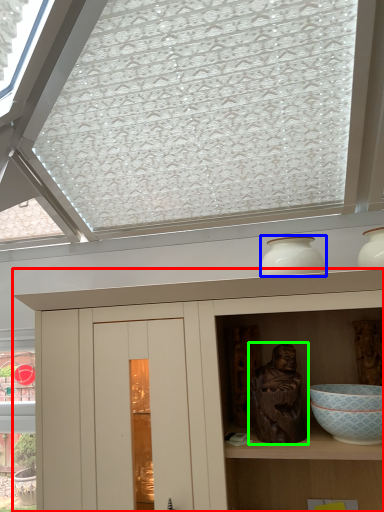
Question: Considering the real-world distances, which object is closest to cupboard (highlighted by a red box)? vase (highlighted by a blue box) or sculpture (highlighted by a green box).

Choices:
 (A) vase
 (B) sculpture

Answer: (B)